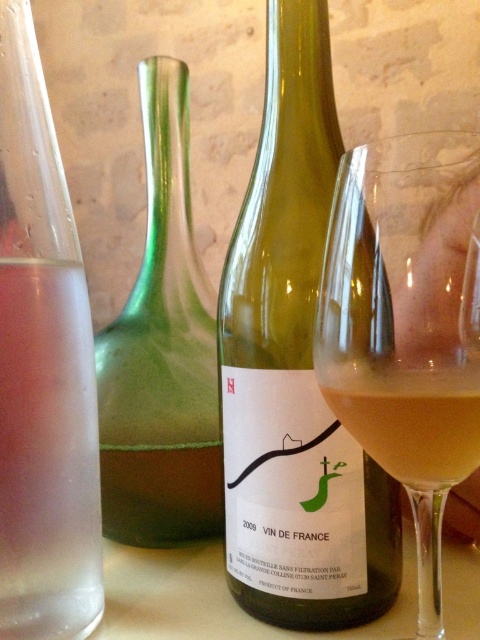
You are a photographer trying to capture a detailed shot of the wine bottle and the glass with the pinkish liquid. You notice two points marked on your camera screen at coordinates point (315, 516) and point (431, 392). Which point should you focus on to ensure the wine bottle and the glass are in sharp focus?

You should focus on point (315, 516) because it is closer to the camera than point (431, 392), ensuring the wine bottle and the glass are in sharp focus.

You are setting up a table for a wine tasting event. You have a green glass wine bottle at center and a clear glass wine glass at center. Which object is taller?

The green glass wine bottle at center is taller than the clear glass wine glass at center according to the description.